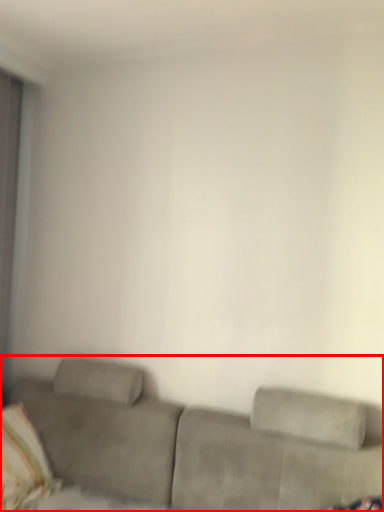
Question: From the image's perspective, considering the relative positions of studio couch (annotated by the red box) and pillow in the image provided, where is studio couch (annotated by the red box) located with respect to the staircase?

Choices:
 (A) below
 (B) above

Answer: (A)